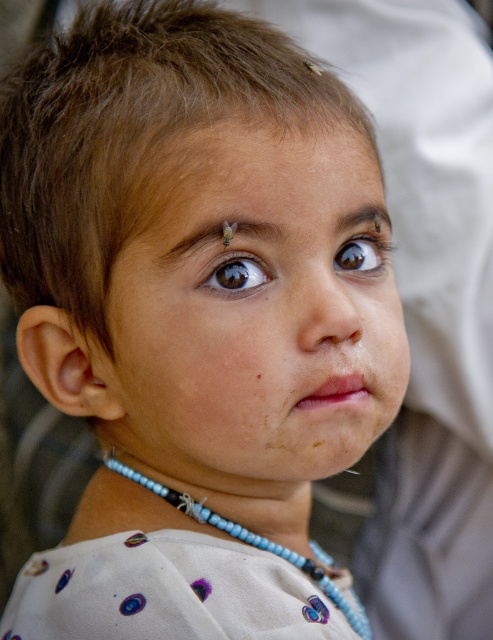
Based on the scene description, which object is located below the other? The smooth skin face at center or the dry skin at center?

The smooth skin face at center is positioned under dry skin at center, meaning the dry skin at center is above the smooth skin face at center.

Based on the scene description, can you determine which area on the child face is wider, the smooth skin face at center or the dry skin at center?

The smooth skin face at center is wider than the dry skin at center according to the description.